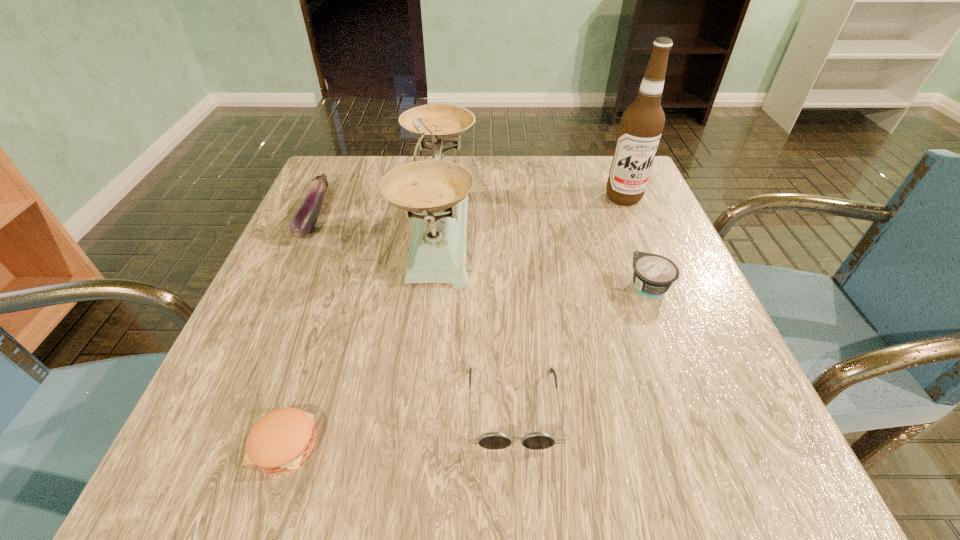
You are a GUI agent. You are given a task and a screenshot of the screen. Output one action in this format:
    pyautogui.click(x=<x>, y=<y>)
    Task: Click on the free spot between the second tallest object and the sunglasses
    Image resolution: width=960 pixels, height=540 pixels.
    Given the screenshot: What is the action you would take?
    pyautogui.click(x=476, y=316)

Where is `free space between the fifth shortest object and the alcohol`? The height and width of the screenshot is (540, 960). free space between the fifth shortest object and the alcohol is located at coordinates (531, 212).

What are the coordinates of `object identified as the closest to the eggplant` in the screenshot? It's located at (436, 191).

Locate an element on the screen. the fourth closest object relative to the sunglasses is located at coordinates (304, 220).

At what (x,y) coordinates should I click in order to perform the action: click on vacant space that satisfies the following two spatial constraints: 1. on the label of the alcohol; 2. on the front-facing side of the scale. Please return your answer as a coordinate pair (x, y). Looking at the image, I should click on (635, 226).

You are a GUI agent. You are given a task and a screenshot of the screen. Output one action in this format:
    pyautogui.click(x=<x>, y=<y>)
    Task: Click on the vacant point that satisfies the following two spatial constraints: 1. on the front-facing side of the fifth shortest object; 2. on the front side of the fifth object from right to left
    
    Given the screenshot: What is the action you would take?
    pyautogui.click(x=415, y=444)

Where is `free location that satisfies the following two spatial constraints: 1. on the back side of the yogurt; 2. on the front-facing side of the second tallest object`? The image size is (960, 540). free location that satisfies the following two spatial constraints: 1. on the back side of the yogurt; 2. on the front-facing side of the second tallest object is located at coordinates (626, 226).